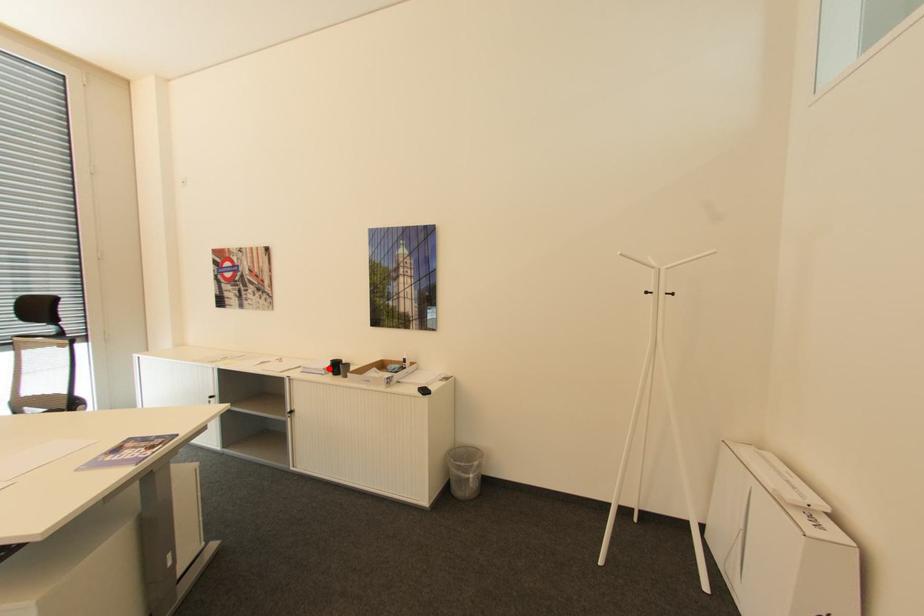
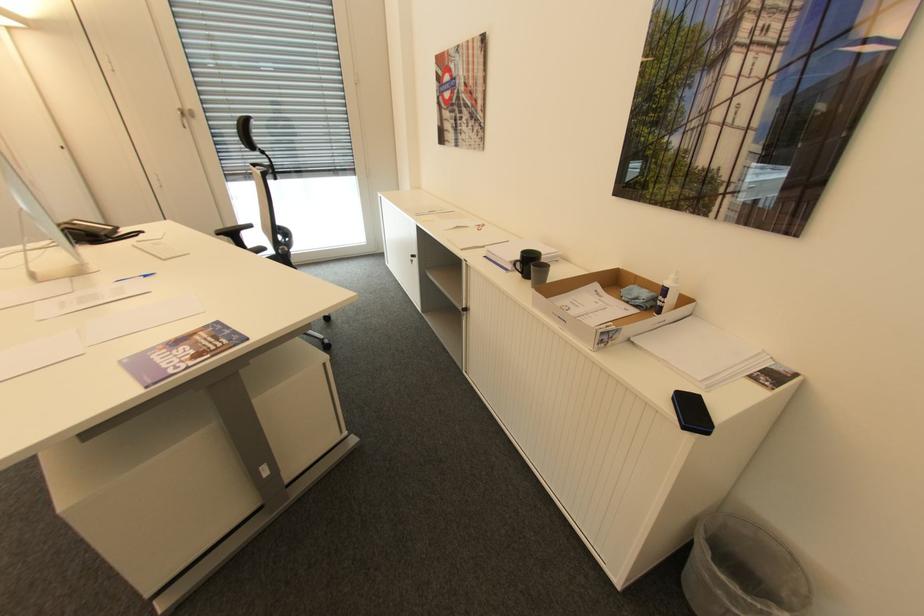
Find the pixel in the second image that matches the highlighted location in the first image.

(516, 262)